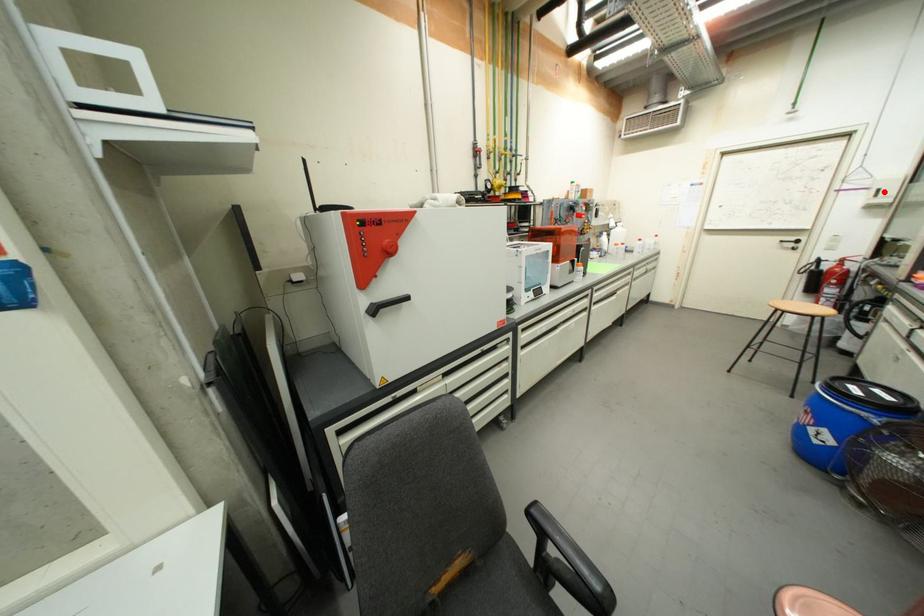
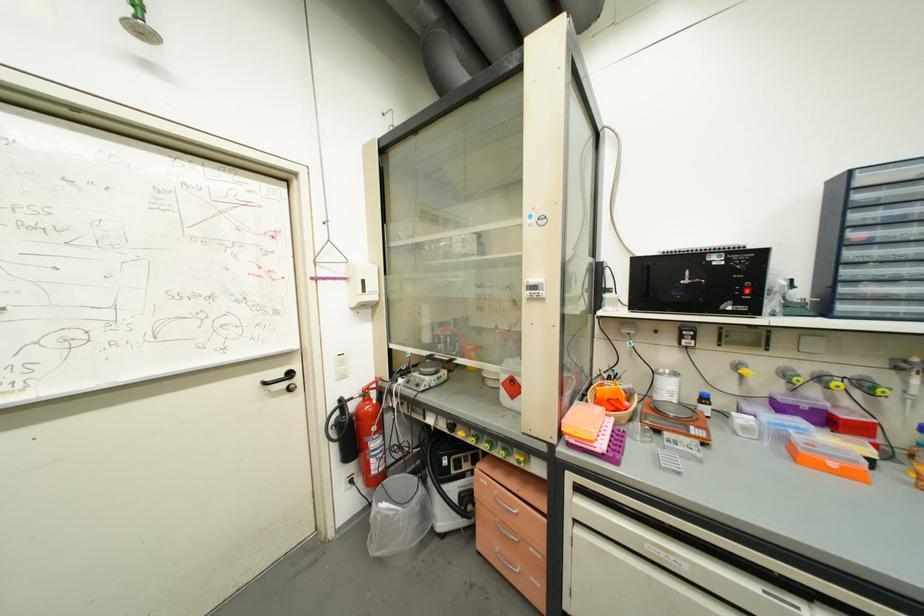
In the second image, find the point that corresponds to the highlighted location in the first image.

(369, 283)